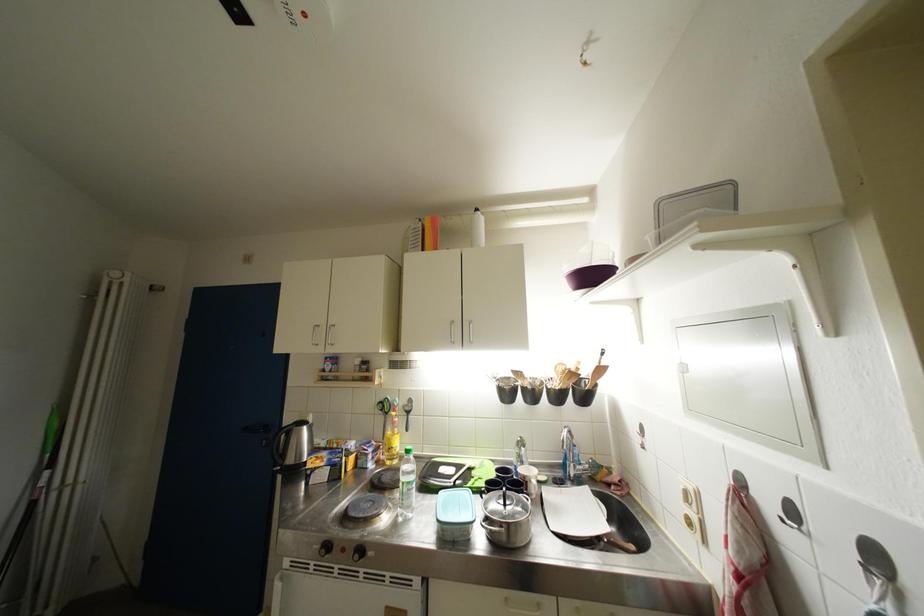
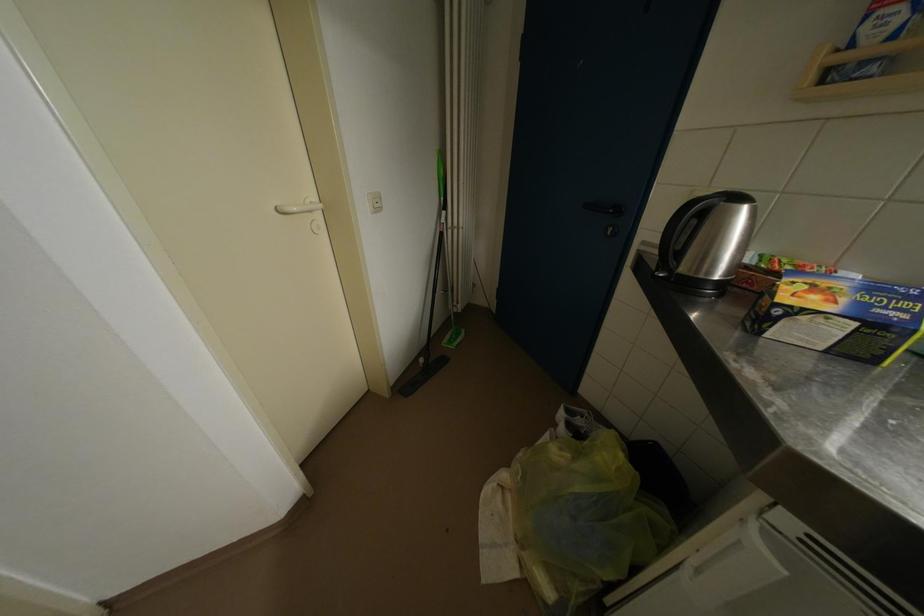
In the second image, find the point that corresponds to point 311,432 in the first image.

(752, 213)